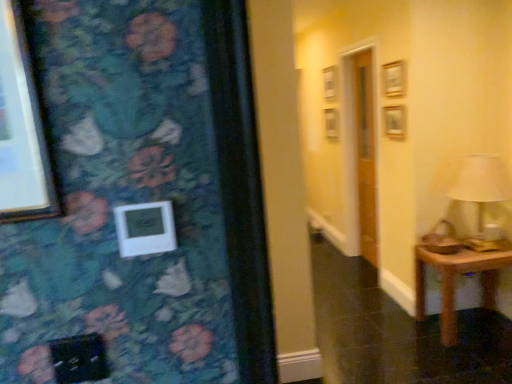
Question: Should I look upward or downward to see brown wooden table at lower right?

Choices:
 (A) down
 (B) up

Answer: (A)

Question: Does white fabric lampshade at right come behind white plastic picture frame at center?

Choices:
 (A) yes
 (B) no

Answer: (A)

Question: Can you confirm if white fabric lampshade at right is wider than white plastic picture frame at center?

Choices:
 (A) no
 (B) yes

Answer: (B)

Question: From a real-world perspective, does white fabric lampshade at right sit lower than white plastic picture frame at center?

Choices:
 (A) no
 (B) yes

Answer: (B)

Question: Does white fabric lampshade at right have a larger size compared to white plastic picture frame at center?

Choices:
 (A) yes
 (B) no

Answer: (A)

Question: Can you confirm if white fabric lampshade at right is positioned to the left of white plastic picture frame at center?

Choices:
 (A) yes
 (B) no

Answer: (B)

Question: Considering the relative sizes of white fabric lampshade at right and white plastic picture frame at center in the image provided, is white fabric lampshade at right smaller than white plastic picture frame at center?

Choices:
 (A) yes
 (B) no

Answer: (B)

Question: From a real-world perspective, is brown wooden table at lower right beneath white fabric lampshade at right?

Choices:
 (A) no
 (B) yes

Answer: (B)

Question: From a real-world perspective, is brown wooden table at lower right over white fabric lampshade at right?

Choices:
 (A) yes
 (B) no

Answer: (B)

Question: Is brown wooden table at lower right looking in the opposite direction of white fabric lampshade at right?

Choices:
 (A) no
 (B) yes

Answer: (A)

Question: Is brown wooden table at lower right behind white fabric lampshade at right?

Choices:
 (A) yes
 (B) no

Answer: (A)

Question: Is brown wooden table at lower right oriented towards white fabric lampshade at right?

Choices:
 (A) no
 (B) yes

Answer: (A)

Question: Can you confirm if brown wooden table at lower right is positioned to the right of white fabric lampshade at right?

Choices:
 (A) yes
 (B) no

Answer: (A)

Question: Considering the relative sizes of white plastic picture frame at center and brown wooden table at lower right in the image provided, is white plastic picture frame at center wider than brown wooden table at lower right?

Choices:
 (A) no
 (B) yes

Answer: (A)